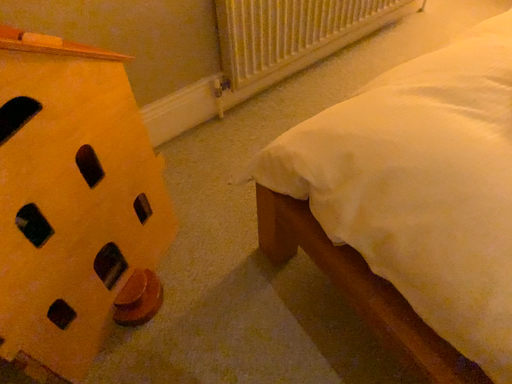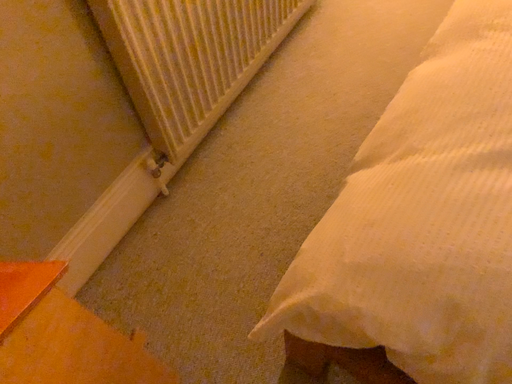
Question: How did the camera likely rotate when shooting the video?

Choices:
 (A) rotated left
 (B) rotated right

Answer: (B)